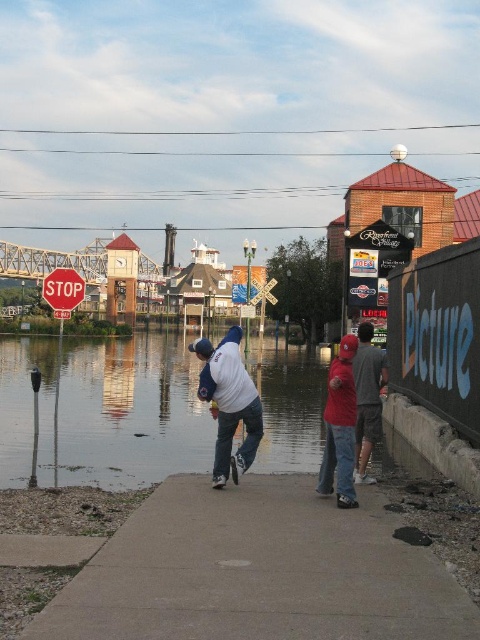
Question: Does concrete sidewalk at lower left have a smaller size compared to clear water at lower center?

Choices:
 (A) no
 (B) yes

Answer: (B)

Question: Which object is farther from the camera taking this photo?

Choices:
 (A) red matte baseball cap at center
 (B) red matte stop sign at upper left

Answer: (B)

Question: Which point appears farthest from the camera in this image?

Choices:
 (A) (225, 477)
 (B) (348, 353)

Answer: (A)

Question: Does gray cotton t-shirt at right come behind red matte stop sign at upper left?

Choices:
 (A) no
 (B) yes

Answer: (A)

Question: Which point is farther to the camera?

Choices:
 (A) concrete sidewalk at lower left
 (B) red matte baseball cap at center
 (C) clear water at lower center
 (D) gray cotton t-shirt at right

Answer: (D)

Question: Can you confirm if white matte baseball cap at center is positioned to the left of red matte stop sign at upper left?

Choices:
 (A) yes
 (B) no

Answer: (B)